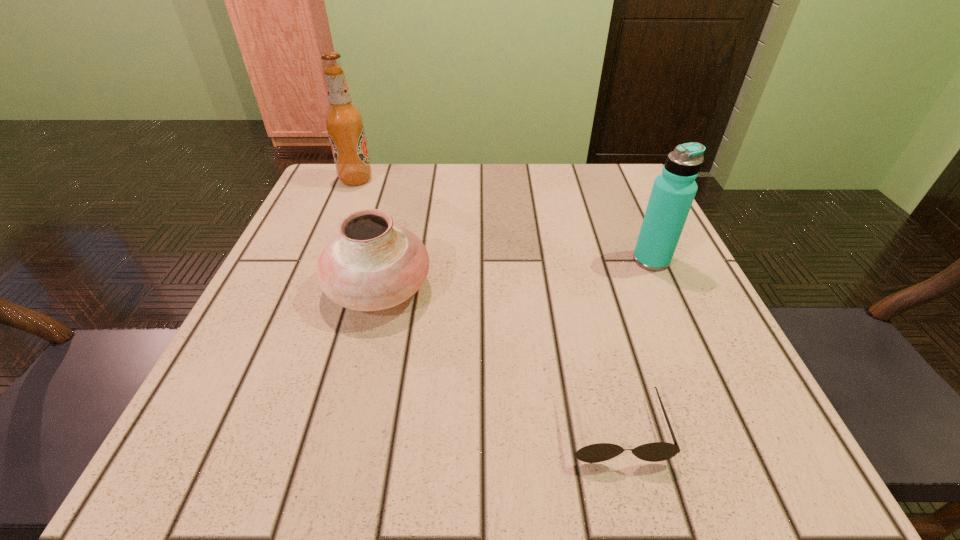
The height and width of the screenshot is (540, 960). In the image, there is a desktop. What are the coordinates of `vacant space at the right edge` in the screenshot? It's located at (674, 256).

At what (x,y) coordinates should I click in order to perform the action: click on free space at the far left corner. Please return your answer as a coordinate pair (x, y). Looking at the image, I should click on (373, 165).

The image size is (960, 540). Find the location of `vacant space at the far right corner`. vacant space at the far right corner is located at coordinates (593, 164).

Where is `vacant area that lies between the water bottle and the sunglasses`? Image resolution: width=960 pixels, height=540 pixels. vacant area that lies between the water bottle and the sunglasses is located at coordinates (633, 344).

At what (x,y) coordinates should I click in order to perform the action: click on vacant space that's between the nearest object and the pottery. Please return your answer as a coordinate pair (x, y). Looking at the image, I should click on (496, 359).

Image resolution: width=960 pixels, height=540 pixels. What are the coordinates of `vacant space in between the sunglasses and the farthest object` in the screenshot? It's located at (485, 304).

You are a GUI agent. You are given a task and a screenshot of the screen. Output one action in this format:
    pyautogui.click(x=<x>, y=<y>)
    Task: Click on the free area in between the rightmost object and the tallest object
    This screenshot has width=960, height=540.
    Given the screenshot: What is the action you would take?
    pyautogui.click(x=504, y=220)

This screenshot has width=960, height=540. Find the location of `vacant area that lies between the water bottle and the nearest object`. vacant area that lies between the water bottle and the nearest object is located at coordinates coord(633,344).

This screenshot has height=540, width=960. I want to click on vacant space that is in between the rightmost object and the beer bottle, so click(504, 220).

At what (x,y) coordinates should I click in order to perform the action: click on unoccupied position between the water bottle and the farthest object. Please return your answer as a coordinate pair (x, y). This screenshot has width=960, height=540. Looking at the image, I should click on (504, 220).